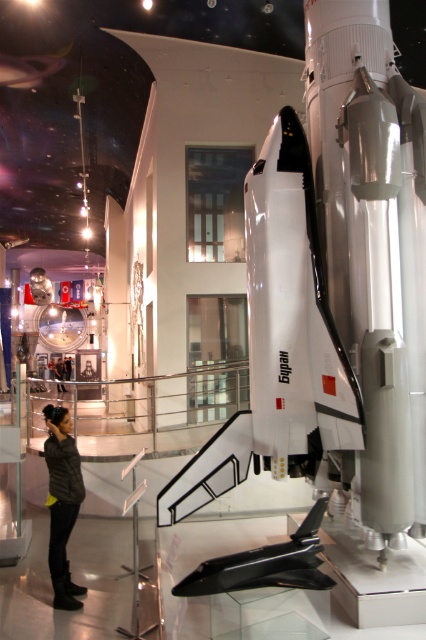
What do you see at coordinates (62, 502) in the screenshot? The image size is (426, 640). I see `dark gray leather jacket at lower left` at bounding box center [62, 502].

Does dark gray leather jacket at lower left have a greater height compared to black leather jacket at lower left?

No, dark gray leather jacket at lower left is not taller than black leather jacket at lower left.

Who is more distant from viewer, (x=60, y=573) or (x=63, y=387)?

Positioned behind is point (x=63, y=387).

Identify the location of dark gray leather jacket at lower left. Image resolution: width=426 pixels, height=640 pixels. (62, 502).

Who is taller, white matte space shuttle at center or black leather jacket at lower left?

With more height is white matte space shuttle at center.

The height and width of the screenshot is (640, 426). In order to click on white matte space shuttle at center in this screenshot , I will do `click(279, 340)`.

Which is behind, point (302, 417) or point (69, 420)?

Positioned behind is point (69, 420).

Which is below, white matte space shuttle at center or dark gray leather jacket at lower left?

dark gray leather jacket at lower left is lower down.

What do you see at coordinates (279, 340) in the screenshot?
I see `white matte space shuttle at center` at bounding box center [279, 340].

The height and width of the screenshot is (640, 426). I want to click on white matte space shuttle at center, so click(x=279, y=340).